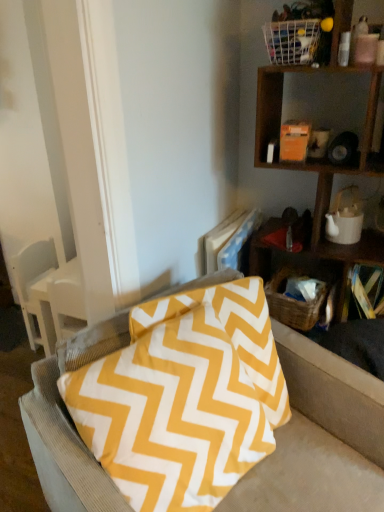
Question: From the image's perspective, is white wire basket at upper right, which ranks as the second basket in bottom-to-top order, located above yellow fabric pillow at center?

Choices:
 (A) yes
 (B) no

Answer: (A)

Question: Is white wire basket at upper right, positioned as the first basket in front-to-back order, not close to yellow fabric pillow at center?

Choices:
 (A) yes
 (B) no

Answer: (A)

Question: Does white wire basket at upper right, which ranks as the second basket in bottom-to-top order, have a greater height compared to yellow fabric pillow at center?

Choices:
 (A) no
 (B) yes

Answer: (A)

Question: Is white wire basket at upper right, which is the second basket from back to front, next to yellow fabric pillow at center?

Choices:
 (A) yes
 (B) no

Answer: (B)

Question: Is white wire basket at upper right, which is the second basket from back to front, smaller than yellow fabric pillow at center?

Choices:
 (A) no
 (B) yes

Answer: (B)

Question: Would you say yellow fabric pillow at center is to the left or to the right of woven brown basket at lower right, the 1th basket positioned from the back, in the picture?

Choices:
 (A) left
 (B) right

Answer: (A)

Question: Considering their positions, is yellow fabric pillow at center located in front of or behind woven brown basket at lower right, which appears as the first basket when ordered from the bottom?

Choices:
 (A) front
 (B) behind

Answer: (A)

Question: Considering the positions of yellow fabric pillow at center and woven brown basket at lower right, which appears as the first basket when ordered from the bottom, in the image, is yellow fabric pillow at center bigger or smaller than woven brown basket at lower right, which appears as the first basket when ordered from the bottom,?

Choices:
 (A) big
 (B) small

Answer: (A)

Question: From a real-world perspective, is yellow fabric pillow at center positioned above or below woven brown basket at lower right, which ranks as the 2th basket in top-to-bottom order?

Choices:
 (A) below
 (B) above

Answer: (B)

Question: From a real-world perspective, is wooden shelf at upper right positioned above or below white wire basket at upper right, which is the second basket from back to front?

Choices:
 (A) below
 (B) above

Answer: (A)

Question: Does point (264, 161) appear closer or farther from the camera than point (294, 25)?

Choices:
 (A) closer
 (B) farther

Answer: (B)

Question: Is wooden shelf at upper right inside the boundaries of white wire basket at upper right, positioned as the first basket in front-to-back order, or outside?

Choices:
 (A) inside
 (B) outside

Answer: (B)

Question: Relative to white wire basket at upper right, which ranks as the second basket in bottom-to-top order, is wooden shelf at upper right in front or behind?

Choices:
 (A) behind
 (B) front

Answer: (B)

Question: Is woven brown basket at lower right, which appears as the first basket when ordered from the bottom, bigger or smaller than white ceramic teapot at upper right?

Choices:
 (A) small
 (B) big

Answer: (B)

Question: Is woven brown basket at lower right, which ranks as the 2th basket in top-to-bottom order, wider or thinner than white ceramic teapot at upper right?

Choices:
 (A) thin
 (B) wide

Answer: (B)